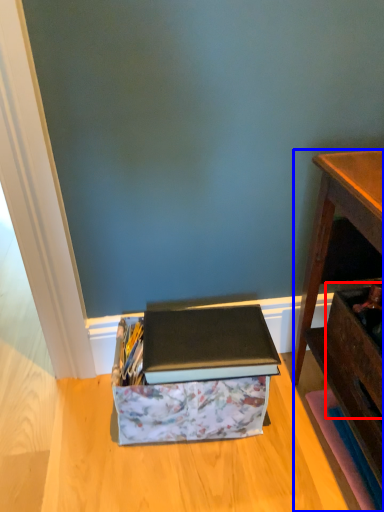
Question: Among these objects, which one is nearest to the camera, drawer (highlighted by a red box) or desk (highlighted by a blue box)?

Choices:
 (A) drawer
 (B) desk

Answer: (B)